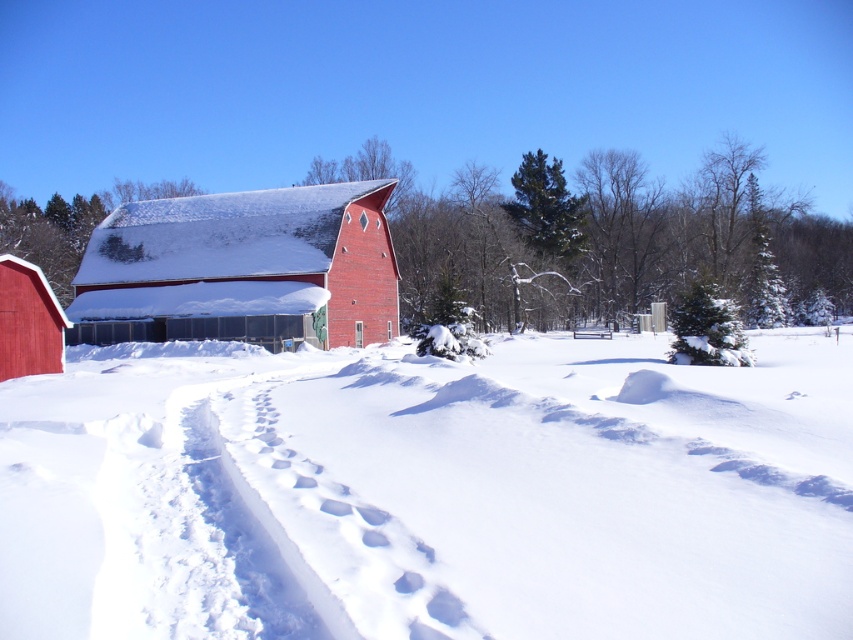
You are standing at the entrance of the red barn and want to walk to the white fluffy snow at center. Which direction should you go?

The white fluffy snow at center is located at point coordinates of (431, 492), so you should walk towards the center of the image to reach it.

You are a snowplow operator who needs to clear the path from the white fluffy snow at center to the matte red barn at lower left. The snowplow has a maximum reach of 10 meters. Can you clear the path without moving the snowplow?

The distance between the white fluffy snow at center and the matte red barn at lower left is 12.15 meters, which exceeds the snowplow operator maximum reach of 10 meters. Therefore, the snowplow cannot clear the path without moving.